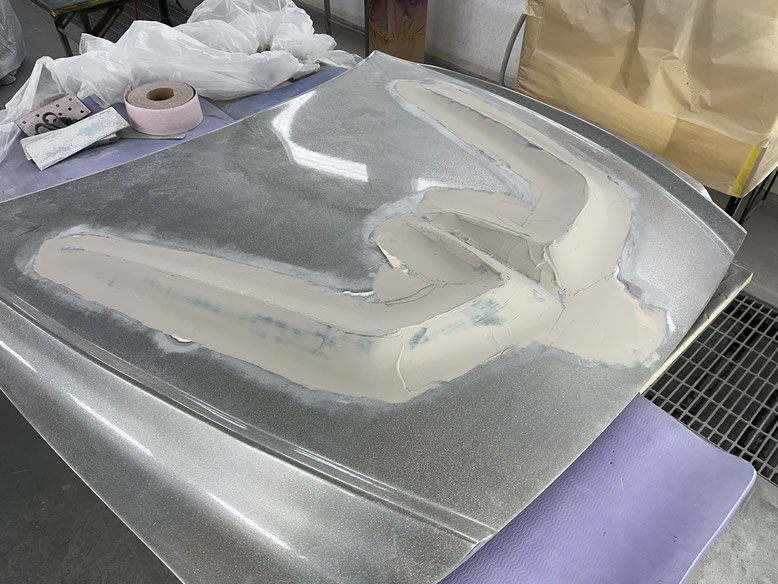
I want to click on white wall, so click(493, 8).